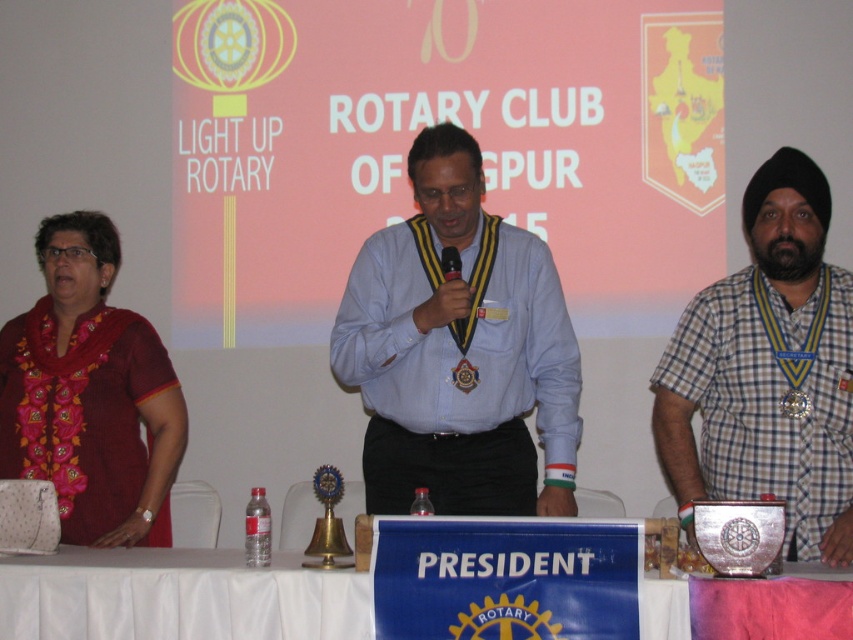
You are attending the event and need to identify the location of the embroidered silk saree at left relative to the white cloth at lower center. Which object is higher in the image?

The embroidered silk saree at left is taller than the white cloth at lower center.

You are a photographer at the event and want to capture a clear photo of both the blue shirt at center and the gold metallic medal at center. Which object should you focus on first to ensure both are in focus?

The blue shirt at center is further to the viewer than the gold metallic medal at center, so focus on the blue shirt at center first to ensure both are in focus.

You are attending a Rotary Club event and notice two items at the center of the image. Which one is more to the left, the blue shirt at center or the gold metallic medal at center?

The blue shirt at center is positioned on the left side of the gold metallic medal at center, so the blue shirt at center is more to the left.